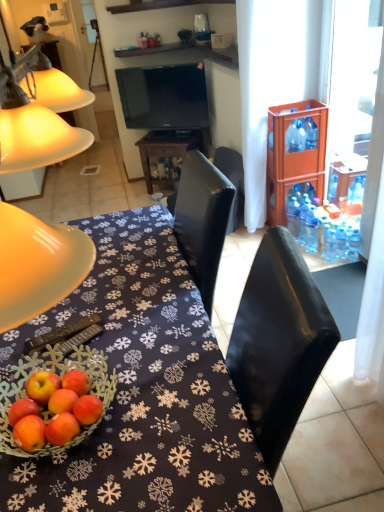
At what (x,y) coordinates should I click in order to perform the action: click on spots to the right of black matte remote control at lower left. Please return your answer as a coordinate pair (x, y). Looking at the image, I should click on (139, 325).